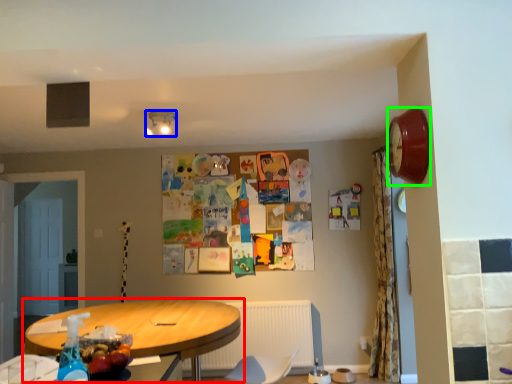
Question: Which is farther away from table (highlighted by a red box)? lamp (highlighted by a blue box) or clock (highlighted by a green box)?

Choices:
 (A) lamp
 (B) clock

Answer: (B)